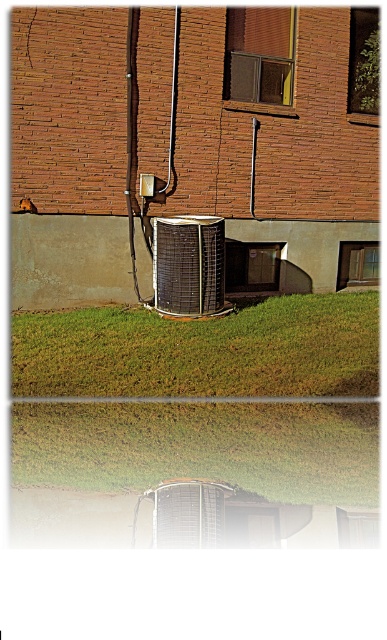
You are a maintenance worker assigned to inspect the metallic grid air conditioner at center. You need to access it from the green grass at lower center. Is the path clear to walk directly underneath the air conditioner?

The green grass at lower center is positioned under metallic grid air conditioner at center, so yes, the path is clear to walk directly underneath the air conditioner.

You are a gardener who needs to mow the lawn. You see the green grass at lower center and the metallic grid air conditioner at center. Which area should you avoid mowing to prevent damaging the air conditioner?

You should avoid mowing near the metallic grid air conditioner at center because the green grass at lower center is larger in size compared to the metallic grid air conditioner at center, indicating it is farther away and the air conditioner is closer to the mowing area.

You are standing at the entrance of the brick building and want to place a small potted plant exactly at the green grass at lower center. According to the image, what are the coordinates where you should place the potted plant?

The coordinates for the green grass at lower center are at point (203,349), so you should place the potted plant there.